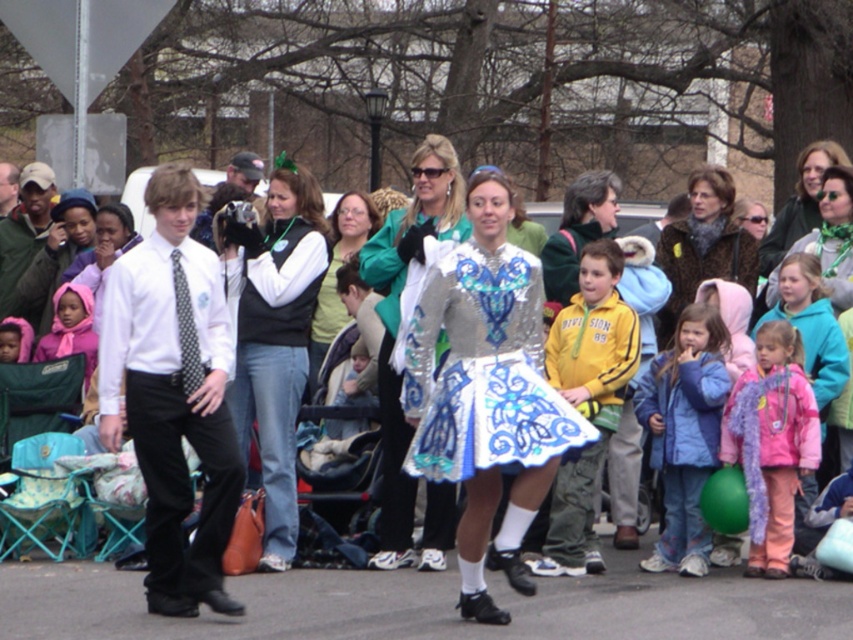
Question: Is blue fleece jacket at lower right below matte pink scarf at lower left?

Choices:
 (A) yes
 (B) no

Answer: (A)

Question: Which point appears farthest from the camera in this image?

Choices:
 (A) (374, 244)
 (B) (697, 182)
 (C) (503, 426)

Answer: (B)

Question: Which of these objects is positioned farthest from the pink fleece jacket at lower right?

Choices:
 (A) polka dot tie at center
 (B) matte green vest at center
 (C) matte black tie at left
 (D) shiny silver dress at center

Answer: (C)

Question: Where is white shirt at left located in relation to polka dot silk tie at left in the image?

Choices:
 (A) left
 (B) right

Answer: (A)

Question: Which point is closer to the camera?

Choices:
 (A) (142, 355)
 (B) (763, 353)
 (C) (677, 372)
 (D) (70, 332)

Answer: (A)

Question: Is white shirt at left to the right of blue fleece jacket at lower right from the viewer's perspective?

Choices:
 (A) no
 (B) yes

Answer: (A)